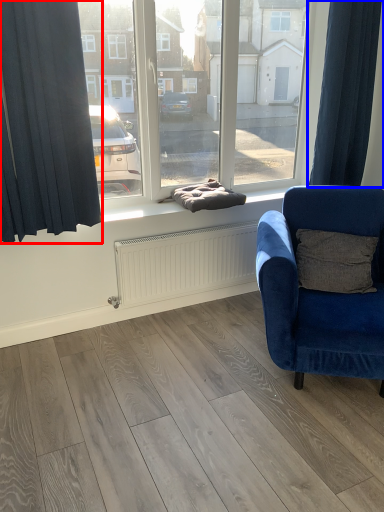
Question: Which point is further to the camera, curtain (highlighted by a red box) or curtain (highlighted by a blue box)?

Choices:
 (A) curtain
 (B) curtain

Answer: (B)